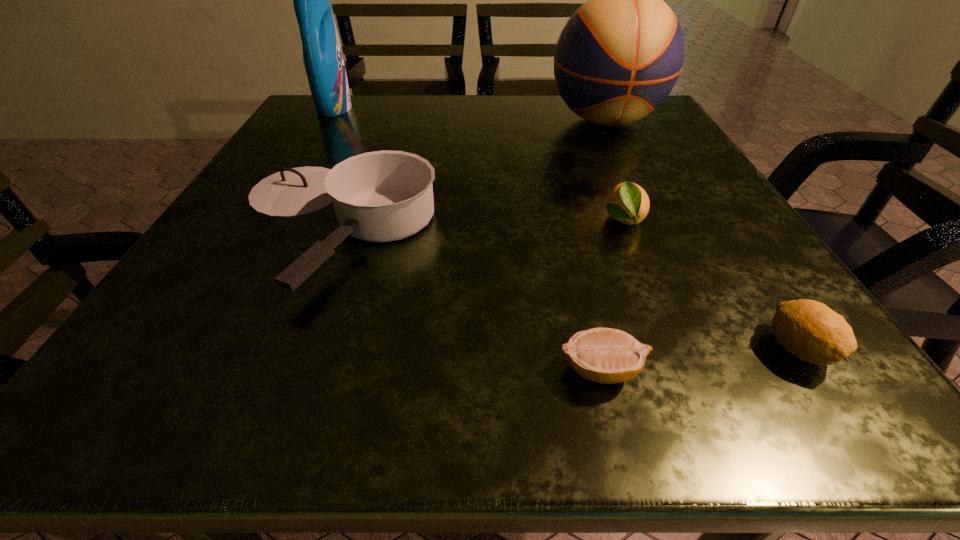
What are the coordinates of `free space at the far edge` in the screenshot? It's located at (380, 128).

The height and width of the screenshot is (540, 960). What are the coordinates of `vacant region at the near edge` in the screenshot? It's located at (322, 382).

The height and width of the screenshot is (540, 960). In the image, there is a desktop. Identify the location of free region at the left edge. (183, 267).

The image size is (960, 540). I want to click on free point at the right edge, so click(x=732, y=225).

You are a GUI agent. You are given a task and a screenshot of the screen. Output one action in this format:
    pyautogui.click(x=<x>, y=<y>)
    Task: Click on the free spot at the far left corner of the desktop
    
    Given the screenshot: What is the action you would take?
    pos(323,130)

In the image, there is a desktop. Where is `vacant space at the near left corner`? The image size is (960, 540). vacant space at the near left corner is located at coordinates (121, 396).

Find the location of a particular element. The width and height of the screenshot is (960, 540). vacant space at the near right corner of the desktop is located at coordinates (834, 369).

Where is `free space that is in between the basketball and the detergent`? This screenshot has width=960, height=540. free space that is in between the basketball and the detergent is located at coordinates (469, 114).

Locate an element on the screen. unoccupied area between the second lemon from right to left and the shortest object is located at coordinates (612, 295).

I want to click on empty space that is in between the second lemon from right to left and the detergent, so 478,164.